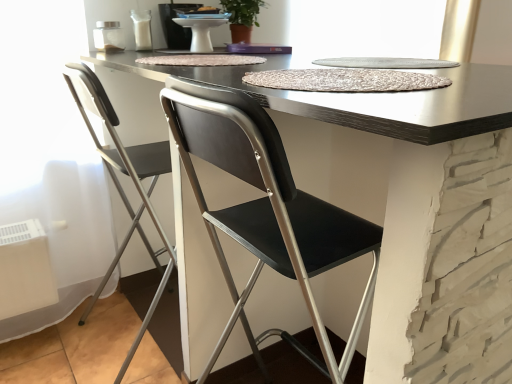
Question: Based on their sizes in the image, would you say metallic silver folding chair at left is bigger or smaller than matte black table at center?

Choices:
 (A) small
 (B) big

Answer: (A)

Question: In terms of width, does metallic silver folding chair at left look wider or thinner when compared to matte black table at center?

Choices:
 (A) wide
 (B) thin

Answer: (B)

Question: Estimate the real-world distances between objects in this image. Which object is farther from the metallic silver folding chair at left?

Choices:
 (A) white glossy sink at upper center
 (B) matte black table at center

Answer: (B)

Question: Which of these objects is positioned farthest from the matte black table at center?

Choices:
 (A) metallic silver folding chair at left
 (B) white glossy sink at upper center

Answer: (B)